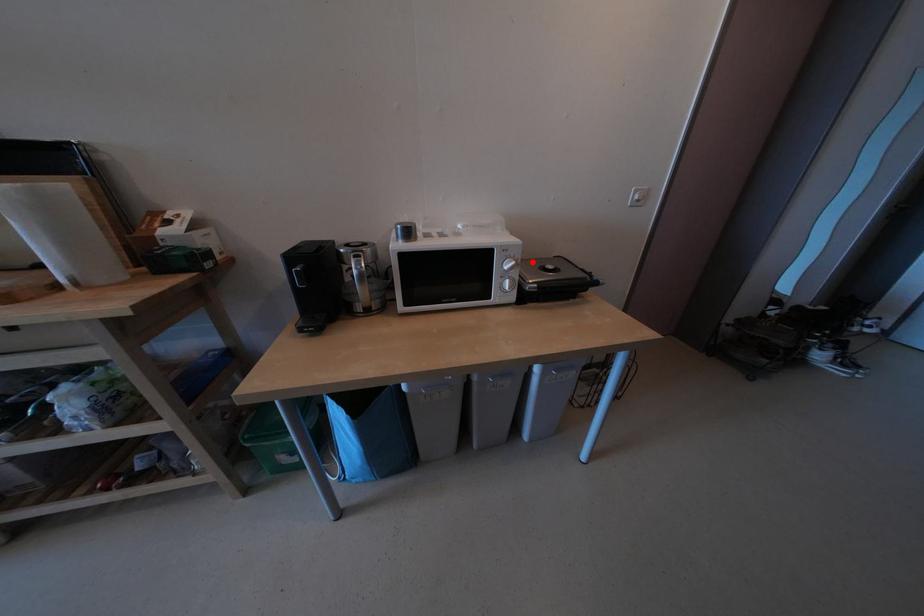
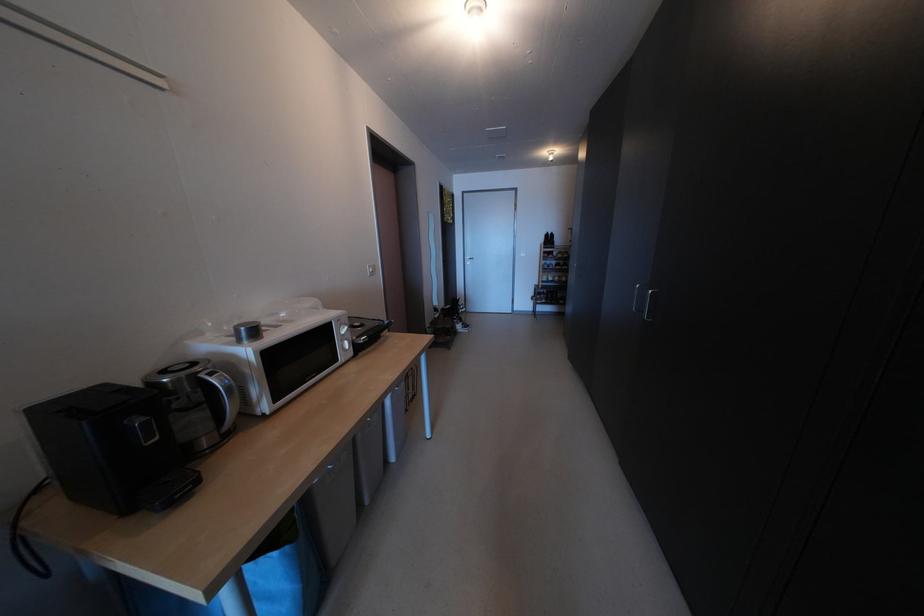
Find the pixel in the second image that matches the highlighted location in the first image.

(360, 328)